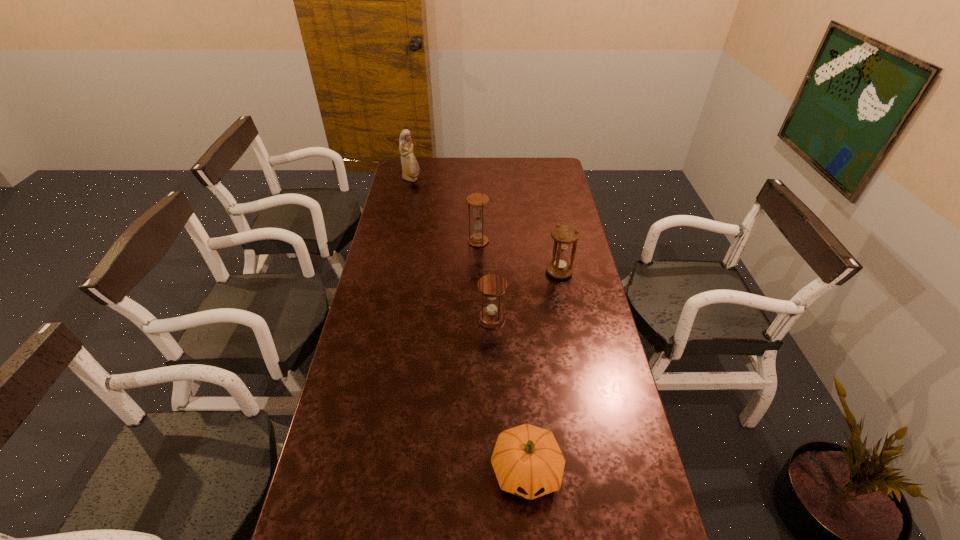
The width and height of the screenshot is (960, 540). I want to click on figurine, so click(410, 169).

You are a GUI agent. You are given a task and a screenshot of the screen. Output one action in this format:
    pyautogui.click(x=<x>, y=<y>)
    Task: Click on the leftmost object
    The height and width of the screenshot is (540, 960).
    Given the screenshot: What is the action you would take?
    pyautogui.click(x=410, y=169)

This screenshot has height=540, width=960. I want to click on the second farthest object, so click(x=477, y=200).

I want to click on the rightmost hourglass, so click(564, 235).

Locate an element on the screen. The width and height of the screenshot is (960, 540). the second farthest hourglass is located at coordinates (564, 235).

Find the location of a particular element. Image resolution: width=960 pixels, height=540 pixels. the shortest hourglass is located at coordinates (492, 286).

In order to click on the nearest hourglass in this screenshot , I will do `click(492, 286)`.

Identify the location of the nearest object. The height and width of the screenshot is (540, 960). (527, 461).

Find the location of a particular element. The image size is (960, 540). free space located 0.340m on the front-facing side of the farthest object is located at coordinates (489, 179).

Identify the location of vacant space located on the right of the fourth nearest object. This screenshot has width=960, height=540. (546, 241).